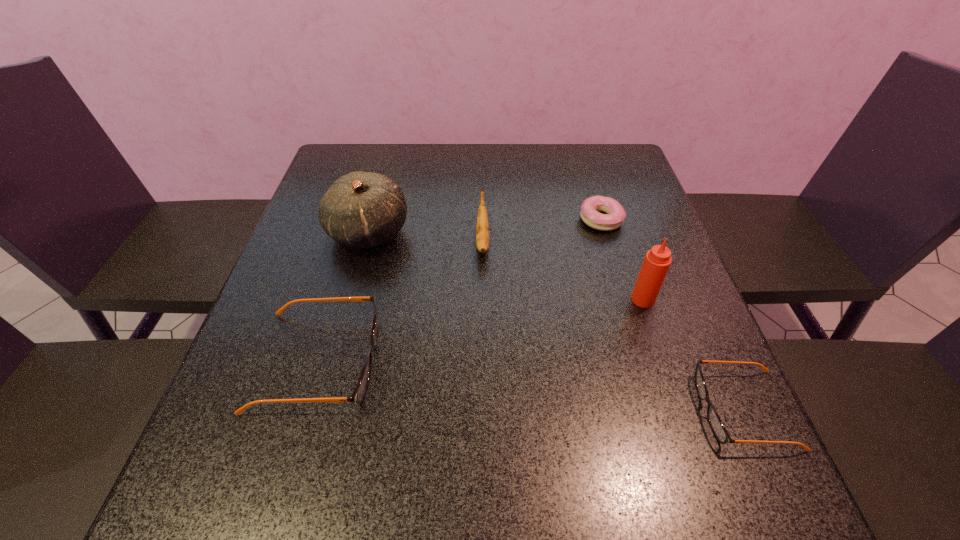
Where is `doughnut that is at the right edge`? The width and height of the screenshot is (960, 540). doughnut that is at the right edge is located at coordinates (591, 207).

Image resolution: width=960 pixels, height=540 pixels. In order to click on Tabasco sauce at the right edge in this screenshot , I will do `click(657, 261)`.

Where is `object situated at the near left corner`? This screenshot has width=960, height=540. object situated at the near left corner is located at coordinates (357, 396).

Locate an element on the screen. object at the near right corner is located at coordinates point(714,420).

Identify the location of free location at the far edge of the desktop. The image size is (960, 540). (518, 170).

Locate an element on the screen. vacant region at the near edge of the desktop is located at coordinates (521, 426).

Find the location of a particular element. vacant area at the left edge of the desktop is located at coordinates (274, 380).

Where is `vacant space at the right edge of the desktop`? vacant space at the right edge of the desktop is located at coordinates (641, 352).

This screenshot has width=960, height=540. In the image, there is a desktop. Find the location of `vacant region at the far left corner`. vacant region at the far left corner is located at coordinates (347, 148).

In the image, there is a desktop. Where is `free space at the far right corner`? This screenshot has width=960, height=540. free space at the far right corner is located at coordinates (589, 179).